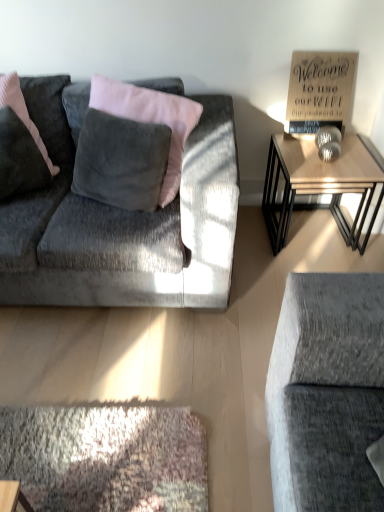
Where is `free region on the left part of wooden table at right`? Image resolution: width=384 pixels, height=512 pixels. free region on the left part of wooden table at right is located at coordinates (250, 239).